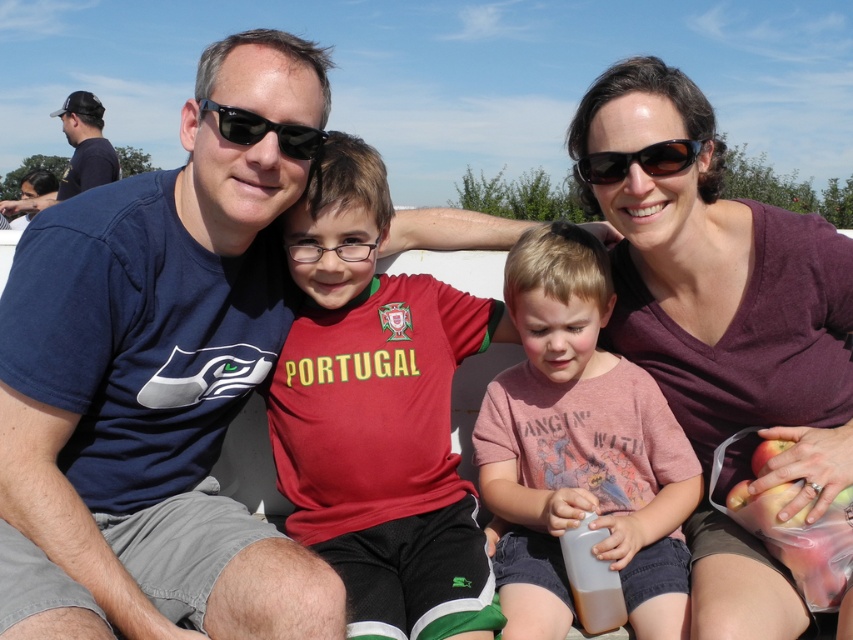
This screenshot has height=640, width=853. What do you see at coordinates (376, 413) in the screenshot? I see `red jersey at center` at bounding box center [376, 413].

Is red jersey at center smaller than black plastic sunglasses at center?

Incorrect, red jersey at center is not smaller in size than black plastic sunglasses at center.

The height and width of the screenshot is (640, 853). Find the location of `red jersey at center`. red jersey at center is located at coordinates (376, 413).

Does matte black cap at upper left appear under black plastic sunglasses at center?

No.

Is matte black cap at upper left wider than black plastic sunglasses at center?

Yes.

The image size is (853, 640). What are the coordinates of `matte black cap at upper left` in the screenshot? It's located at (85, 145).

Identify the location of matte black cap at upper left. (85, 145).

Between matte purple shirt at center and brown matte sunglasses at center, which one appears on the right side from the viewer's perspective?

From the viewer's perspective, matte purple shirt at center appears more on the right side.

Who is more forward, (605, 83) or (670, 152)?

Point (670, 152)

You are a GUI agent. You are given a task and a screenshot of the screen. Output one action in this format:
    pyautogui.click(x=<x>, y=<y>)
    Task: Click on the matte purple shirt at center
    This screenshot has height=640, width=853.
    Given the screenshot: What is the action you would take?
    pyautogui.click(x=721, y=285)